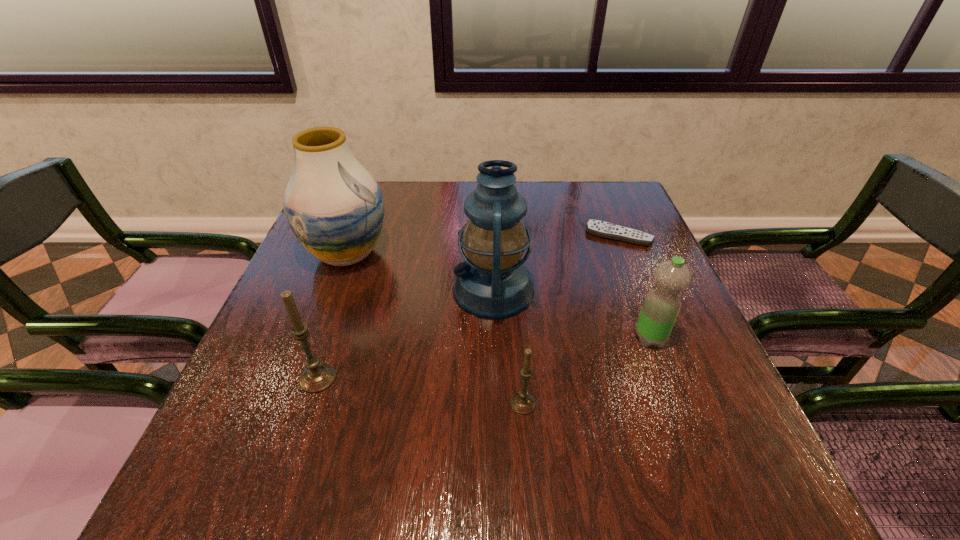
The width and height of the screenshot is (960, 540). I want to click on vacant point located on the left of the remote control, so click(524, 235).

Find the location of a particular element. This screenshot has width=960, height=540. free spot located 0.100m on the face of the lantern is located at coordinates (409, 290).

You are a GUI agent. You are given a task and a screenshot of the screen. Output one action in this format:
    pyautogui.click(x=<x>, y=<y>)
    Task: Click on the free space located 0.160m on the face of the lantern
    
    Given the screenshot: What is the action you would take?
    pyautogui.click(x=383, y=290)

Locate an element on the screen. Image resolution: width=960 pixels, height=540 pixels. vacant space located on the face of the lantern is located at coordinates (422, 290).

Find the location of a particular element. free location located on the front of the water bottle is located at coordinates (662, 371).

Find the location of a particular element. object present at the far edge is located at coordinates tap(603, 229).

I want to click on object present at the near edge, so click(523, 403).

Find the location of `candle that is at the left edge`. candle that is at the left edge is located at coordinates (317, 377).

The image size is (960, 540). What are the coordinates of `vase positioned at the left edge` in the screenshot? It's located at (334, 207).

The width and height of the screenshot is (960, 540). In order to click on remote control positioned at the right edge in this screenshot , I will do `click(603, 229)`.